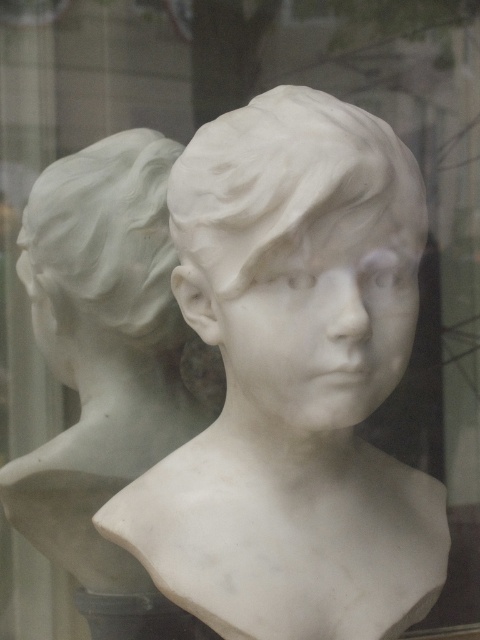
Question: Which object appears farthest from the camera in this image?

Choices:
 (A) white marble head at left
 (B) white marble bust at left
 (C) white marble bust at center

Answer: (A)

Question: Which point is farther to the camera?

Choices:
 (A) (127, 269)
 (B) (86, 413)

Answer: (B)

Question: Is white marble bust at center closer to the viewer compared to white marble head at left?

Choices:
 (A) no
 (B) yes

Answer: (B)

Question: Among these objects, which one is nearest to the camera?

Choices:
 (A) white marble bust at center
 (B) white marble head at left
 (C) white marble bust at left

Answer: (A)

Question: Does white marble bust at left appear under white marble bust at center?

Choices:
 (A) yes
 (B) no

Answer: (A)

Question: In this image, where is white marble bust at left located relative to white marble head at left?

Choices:
 (A) left
 (B) right

Answer: (B)